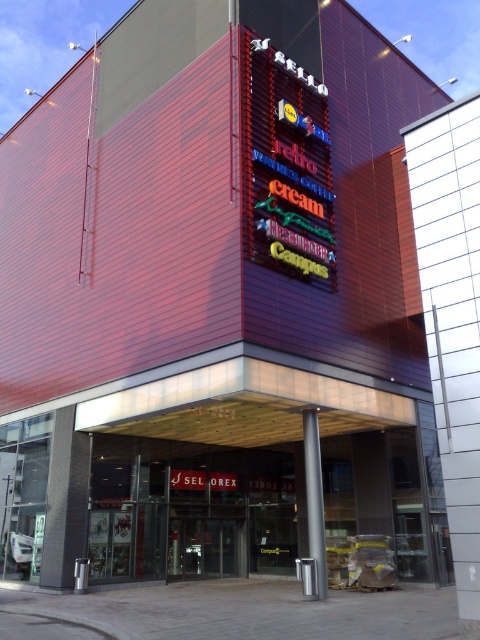
Who is positioned more to the right, neon signboard at center or transparent glass doors at center?

neon signboard at center is more to the right.

Is point (280, 120) farther from viewer compared to point (170, 536)?

No, (280, 120) is in front of (170, 536).

This screenshot has height=640, width=480. I want to click on neon signboard at center, so click(x=286, y=164).